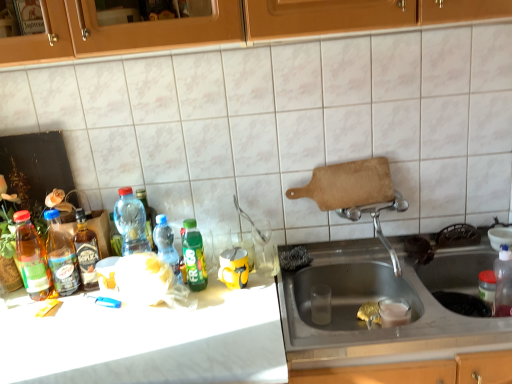
Where is `vacant region in front of translucent glass bottle at left, which is counted as the third bottle, starting from the left`? The height and width of the screenshot is (384, 512). vacant region in front of translucent glass bottle at left, which is counted as the third bottle, starting from the left is located at coordinates (68, 316).